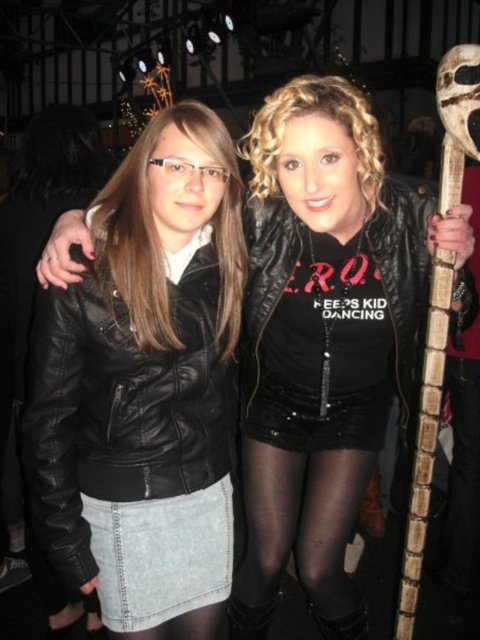
You are a photographer trying to adjust the lighting for a photo shoot. You notice the black leather jacket at left and the denim skirt at lower left. Which clothing item requires more space in the frame to avoid being cut off?

The black leather jacket at left requires more space in the frame because it has a larger size compared to the denim skirt at lower left.

You are a photographer at a social event. You have to decide which black leather jacket to focus on for a closeup shot. The two jackets are the black leather jacket at left and the matte black leather jacket at center. Which one is shorter in height?

The black leather jacket at left is shorter in height compared to the matte black leather jacket at center.

You are standing in front of the image and want to locate the black leather jacket at left. Can you tell me its coordinates in the image?

The black leather jacket at left is located at coordinates point (140, 342).